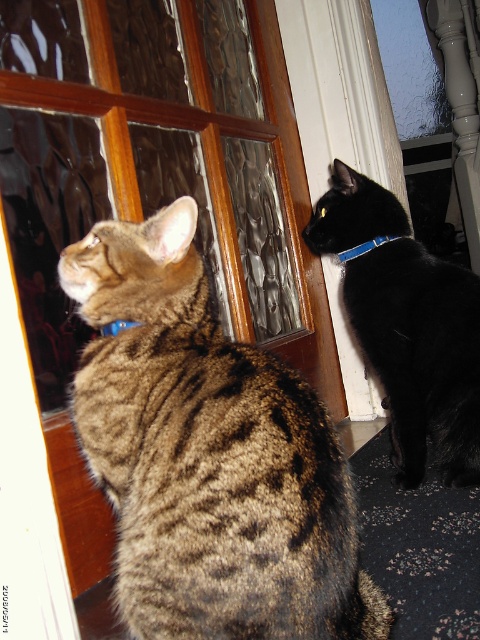
Is point (231, 529) farther from viewer compared to point (462, 321)?

No, (231, 529) is closer to viewer.

Is point (205, 595) less distant than point (432, 298)?

That is True.

Is point (93, 429) behind point (402, 260)?

No.

You are a GUI agent. You are given a task and a screenshot of the screen. Output one action in this format:
    pyautogui.click(x=<x>, y=<y>)
    Task: Click on the brown textured fur cat at left
    This screenshot has width=480, height=640.
    Given the screenshot: What is the action you would take?
    pyautogui.click(x=208, y=456)

Measure the distance between point (344,218) and camera.

Point (344,218) is 5.39 feet from camera.

Can you confirm if black smooth fur cat at upper right is thinner than blue fabric neckband at upper right?

No, black smooth fur cat at upper right is not thinner than blue fabric neckband at upper right.

Who is more forward, (403,326) or (349,248)?

Point (403,326) is in front.

I want to click on black smooth fur cat at upper right, so click(x=408, y=324).

Is point (344, 259) more distant than point (108, 323)?

Yes, point (344, 259) is behind point (108, 323).

Does blue fabric neckband at upper right have a greater height compared to matte plastic neckband at upper left?

Indeed, blue fabric neckband at upper right has a greater height compared to matte plastic neckband at upper left.

Does point (345, 259) come farther from viewer compared to point (129, 323)?

Yes, it is behind point (129, 323).

At what (x,y) coordinates should I click in order to perform the action: click on blue fabric neckband at upper right. Please return your answer as a coordinate pair (x, y). Looking at the image, I should click on (363, 248).